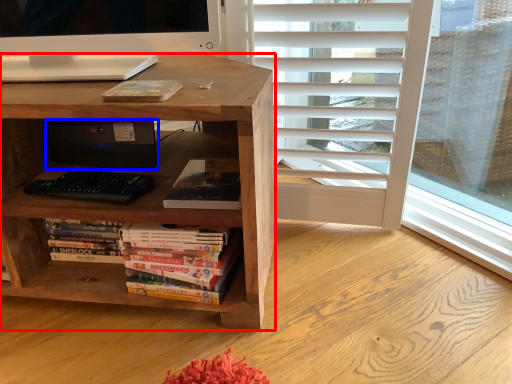
Question: Which object is closer to the camera taking this photo, desk (highlighted by a red box) or computer (highlighted by a blue box)?

Choices:
 (A) desk
 (B) computer

Answer: (A)